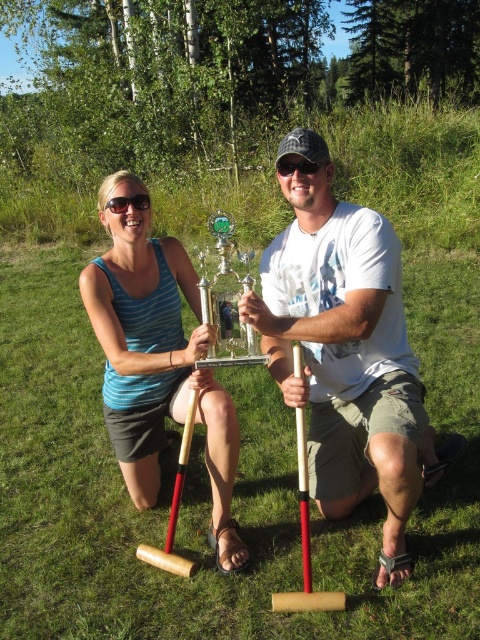
Question: Does white cotton shirt at center have a lesser width compared to matte blue tank top at center?

Choices:
 (A) no
 (B) yes

Answer: (A)

Question: Which object appears farthest from the camera in this image?

Choices:
 (A) white cotton shirt at center
 (B) matte blue tank top at center

Answer: (B)

Question: From the image, what is the correct spatial relationship of white cotton shirt at center in relation to matte blue tank top at center?

Choices:
 (A) above
 (B) below

Answer: (A)

Question: Among these points, which one is nearest to the camera?

Choices:
 (A) (135, 422)
 (B) (296, 129)

Answer: (A)

Question: Can you confirm if white cotton shirt at center is wider than matte blue tank top at center?

Choices:
 (A) no
 (B) yes

Answer: (B)